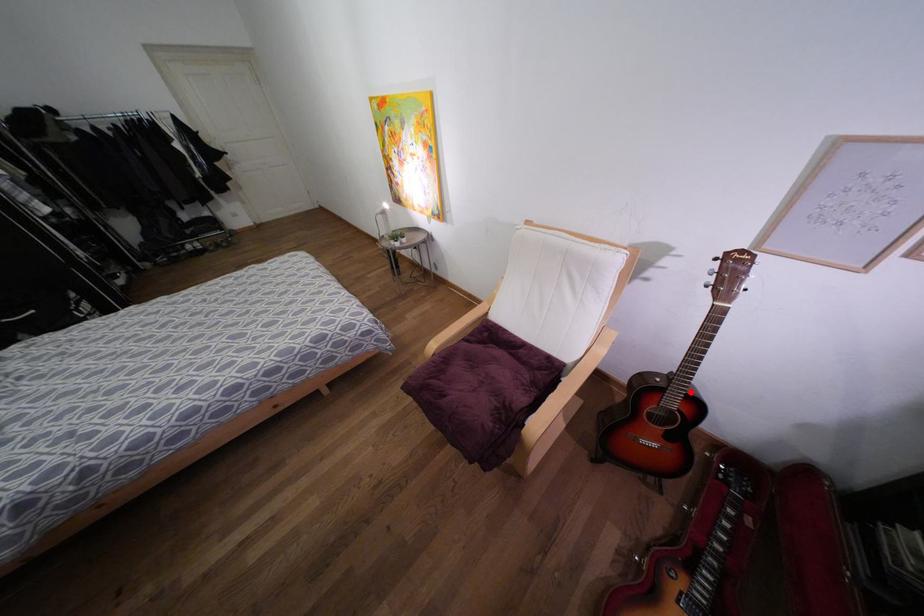
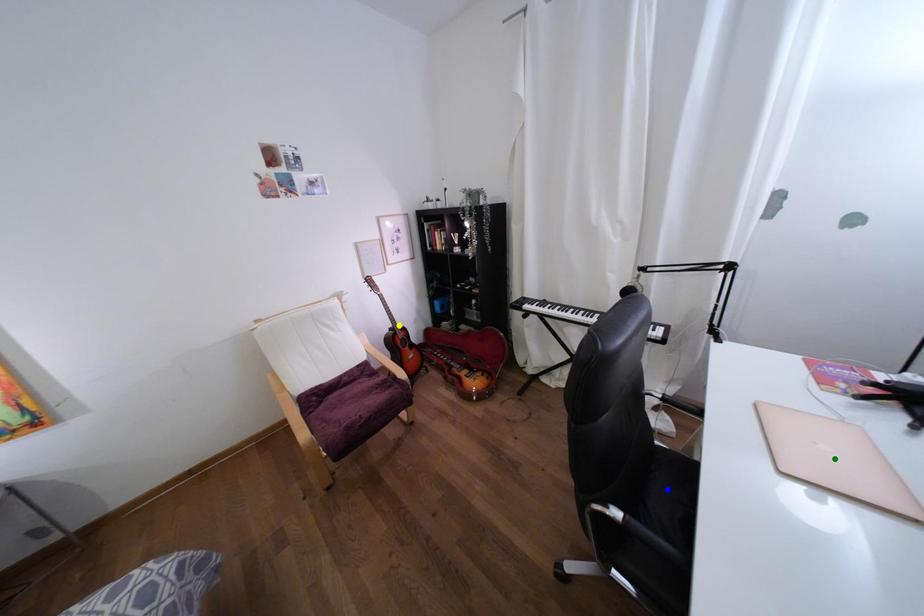
Question: I am providing you with two images of the same scene from different viewpoints. A red point is marked on the first image. You are given multiple points on the second image. Which point in image 2 represents the same 3d spot as the red point in image 1?

Choices:
 (A) yellow point
 (B) blue point
 (C) green point

Answer: (A)